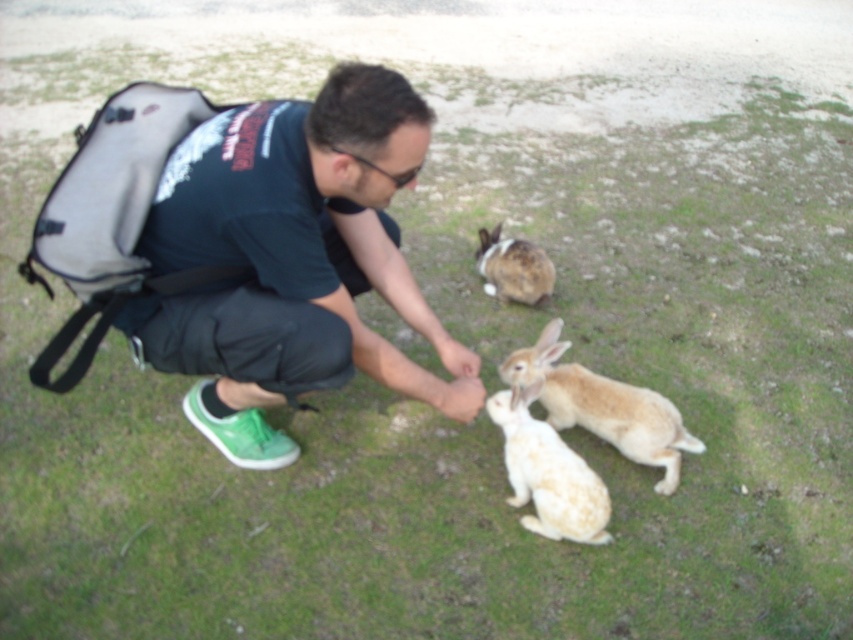
You are a wildlife photographer trying to capture a photo of the light brown fur rabbit at center and the brown speckled fur at center. Since you want to highlight their size difference, which rabbit should you focus on first to ensure proper framing?

The light brown fur rabbit at center is larger in size than brown speckled fur at center, so you should focus on the light brown fur rabbit at center first to ensure proper framing.

You are a wildlife photographer aiming to capture a photo of the white fluffy rabbit at lower center and the brown speckled fur at center. Based on their positions, which rabbit is positioned to the right of the other?

The white fluffy rabbit at lower center is to the right of brown speckled fur at center.